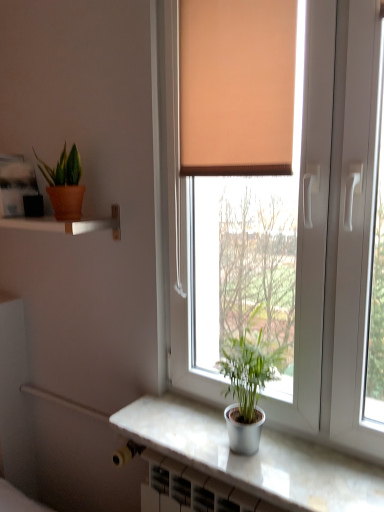
I want to click on vacant area that lies between white plastic window at center and silver metallic pot at window, which is counted as the first houseplant, starting from the bottom, so click(271, 476).